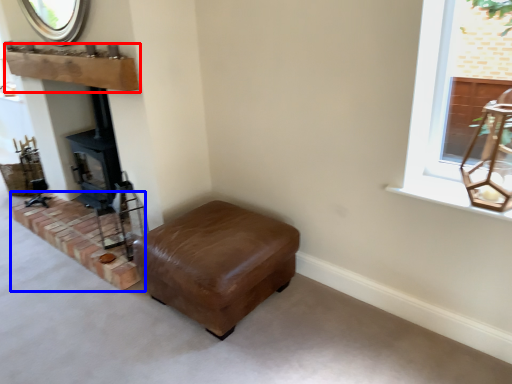
Question: Which of the following is the farthest to the observer, mantle (highlighted by a red box) or brickwork (highlighted by a blue box)?

Choices:
 (A) mantle
 (B) brickwork

Answer: (B)